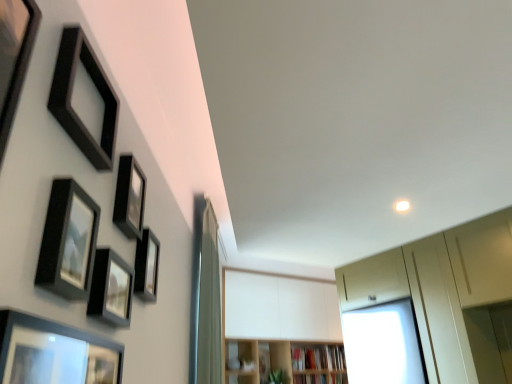
Question: Is matte black picture frame at center-left, positioned as the sixth picture frame in front-to-back order, spatially inside black matte picture frame at upper left, which appears as the 3th picture frame when viewed from the front, or outside of it?

Choices:
 (A) outside
 (B) inside

Answer: (A)

Question: Considering the positions of matte black picture frame at center-left, arranged as the 1th picture frame when viewed from the back, and black matte picture frame at upper left, which is the fourth picture frame in back-to-front order, in the image, is matte black picture frame at center-left, arranged as the 1th picture frame when viewed from the back, taller or shorter than black matte picture frame at upper left, which is the fourth picture frame in back-to-front order,?

Choices:
 (A) tall
 (B) short

Answer: (B)

Question: Estimate the real-world distances between objects in this image. Which object is farther from the matte black picture frame at lower left, the 1th picture frame viewed from the front?

Choices:
 (A) matte black picture frame at upper left, marked as the 4th picture frame in a front-to-back arrangement
 (B) silky white curtain at center
 (C) black matte picture frame at upper left, which is the fourth picture frame in back-to-front order
 (D) matte black picture frame at center-left, positioned as the sixth picture frame in front-to-back order
 (E) matte black picture frame at upper left, which appears as the fifth picture frame when viewed from the back

Answer: (B)

Question: Estimate the real-world distances between objects in this image. Which object is farther from the matte black picture frame at lower left, the 1th picture frame viewed from the front?

Choices:
 (A) matte black picture frame at center-left, positioned as the sixth picture frame in front-to-back order
 (B) silky white curtain at center
 (C) light wood bookshelf at center, acting as the 2th shelf starting from the right
 (D) black matte picture frame at upper left, which appears as the 3th picture frame when viewed from the front
 (E) matte white cabinet at upper right

Answer: (C)